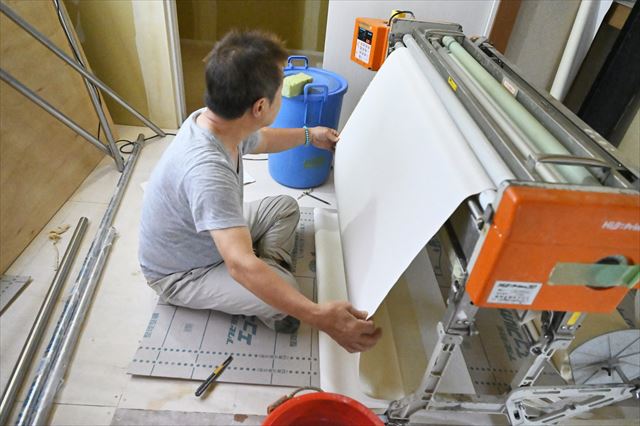
This screenshot has height=426, width=640. In order to click on white paper roll in this screenshot , I will do `click(410, 107)`.